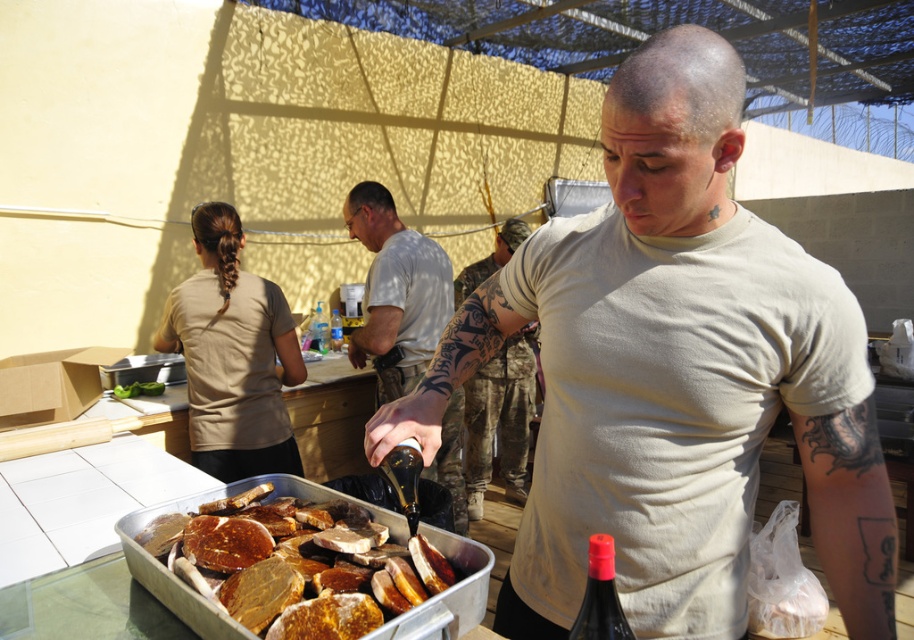
Question: Estimate the real-world distances between objects in this image. Which object is closer to the light beige t-shirt at center?

Choices:
 (A) matte black bottle at center
 (B) brown matte meat at center
 (C) translucent plastic bottle at center
 (D) dark brown glass bottle at lower center

Answer: (A)

Question: Is matte black bottle at center to the left of light beige t-shirt at center from the viewer's perspective?

Choices:
 (A) no
 (B) yes

Answer: (B)

Question: Which object appears farthest from the camera in this image?

Choices:
 (A) matte khaki t-shirt at center
 (B) dark brown glass bottle at lower center
 (C) translucent plastic bottle at center

Answer: (C)

Question: Which point is closer to the camera taking this photo?

Choices:
 (A) (452, 480)
 (B) (219, 493)
 (C) (611, 538)

Answer: (C)

Question: Can you confirm if matte khaki t-shirt at center is positioned below light beige t-shirt at center?

Choices:
 (A) yes
 (B) no

Answer: (B)

Question: Is dark brown glass bottle at lower center bigger than translucent plastic bottle at center?

Choices:
 (A) yes
 (B) no

Answer: (B)